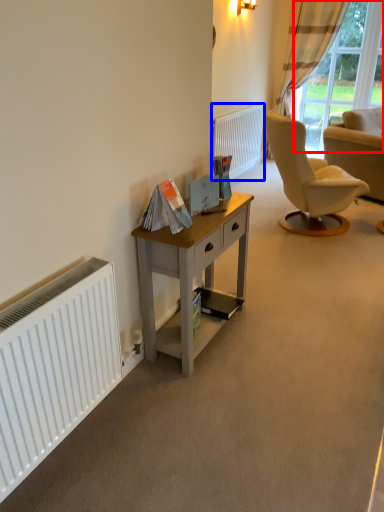
Question: Which object is closer to the camera taking this photo, bay window (highlighted by a red box) or radiator (highlighted by a blue box)?

Choices:
 (A) bay window
 (B) radiator

Answer: (B)